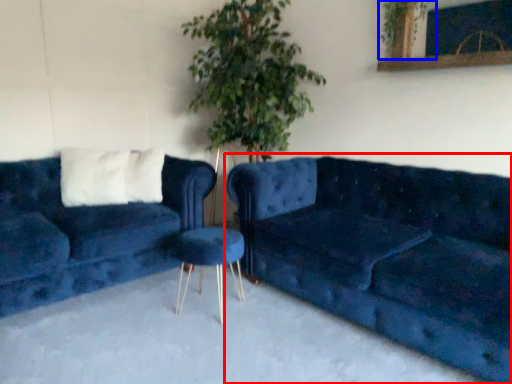
Question: Which object appears closest to the camera in this image, studio couch (highlighted by a red box) or plant (highlighted by a blue box)?

Choices:
 (A) studio couch
 (B) plant

Answer: (A)